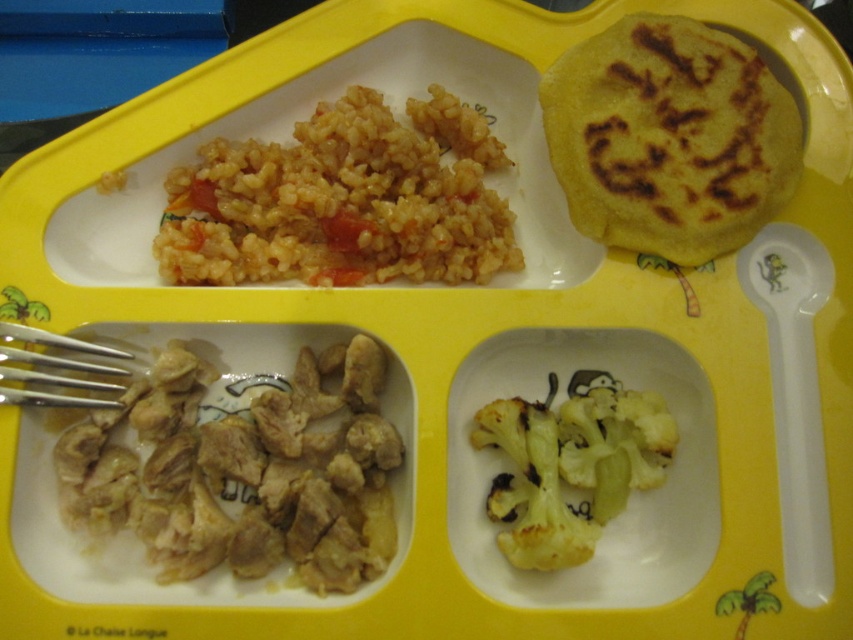
You are looking at the yellow segmented tray with three compartments. There are two points marked on the tray at coordinates point [590,528] and point [642,428]. If you were to place a small sticker on the tray, which point would require you to reach closer to the tray to place the sticker?

Point [642,428] would require reaching closer to the tray because it is farther from the camera compared to point [590,528], which is closer.